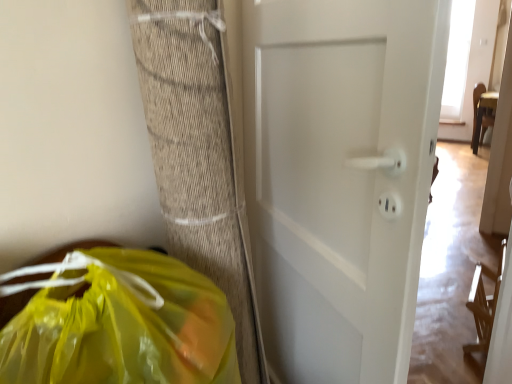
You are a GUI agent. You are given a task and a screenshot of the screen. Output one action in this format:
    pyautogui.click(x=<x>, y=<y>)
    Task: Click on the white matte door at center
    
    Given the screenshot: What is the action you would take?
    click(x=340, y=178)

This screenshot has width=512, height=384. What do you see at coordinates (340, 178) in the screenshot?
I see `white matte door at center` at bounding box center [340, 178].

What is the approximate height of white matte door at center?

It is 4.69 feet.

What do you see at coordinates (120, 323) in the screenshot? I see `translucent yellow plastic bag at lower left` at bounding box center [120, 323].

What is the approximate width of translucent yellow plastic bag at lower left?

translucent yellow plastic bag at lower left is 13.39 inches wide.

Locate an element on the screen. translucent yellow plastic bag at lower left is located at coordinates (120, 323).

At what (x,y) coordinates should I click in order to perform the action: click on white matte door at center. Please return your answer as a coordinate pair (x, y). The height and width of the screenshot is (384, 512). Looking at the image, I should click on (340, 178).

Does translucent yellow plastic bag at lower left appear on the right side of white matte door at center?

In fact, translucent yellow plastic bag at lower left is to the left of white matte door at center.

Is translucent yellow plastic bag at lower left in front of white matte door at center?

Yes, translucent yellow plastic bag at lower left is closer to the camera.

Is point (152, 253) positioned in front of point (385, 91)?

No.

From the image's perspective, is translucent yellow plastic bag at lower left below white matte door at center?

Correct, translucent yellow plastic bag at lower left appears lower than white matte door at center in the image.

In the scene shown: From a real-world perspective, is translucent yellow plastic bag at lower left physically located above or below white matte door at center?

translucent yellow plastic bag at lower left is situated higher than white matte door at center in the real world.

In terms of width, does translucent yellow plastic bag at lower left look wider or thinner when compared to white matte door at center?

Clearly, translucent yellow plastic bag at lower left has more width compared to white matte door at center.

Considering the relative sizes of translucent yellow plastic bag at lower left and white matte door at center in the image provided, is translucent yellow plastic bag at lower left taller than white matte door at center?

In fact, translucent yellow plastic bag at lower left may be shorter than white matte door at center.

Looking at the image, does translucent yellow plastic bag at lower left seem bigger or smaller compared to white matte door at center?

translucent yellow plastic bag at lower left is smaller than white matte door at center.

Is white matte door at center completely or partially inside translucent yellow plastic bag at lower left?

Actually, white matte door at center is outside translucent yellow plastic bag at lower left.

Are translucent yellow plastic bag at lower left and white matte door at center beside each other?

No, translucent yellow plastic bag at lower left is not in contact with white matte door at center.

Is white matte door at center at the back of translucent yellow plastic bag at lower left?

No, translucent yellow plastic bag at lower left's orientation is not away from white matte door at center.

Find the location of a particular element. The width and height of the screenshot is (512, 384). plastic bag in front of the white matte door at center is located at coordinates (120, 323).

Does white matte door at center appear on the right side of translucent yellow plastic bag at lower left?

Correct, you'll find white matte door at center to the right of translucent yellow plastic bag at lower left.

Is white matte door at center in front of or behind translucent yellow plastic bag at lower left in the image?

white matte door at center is positioned farther from the viewer than translucent yellow plastic bag at lower left.

Which is in front, point (353, 236) or point (117, 270)?

Positioned in front is point (117, 270).

From the image's perspective, would you say white matte door at center is positioned over translucent yellow plastic bag at lower left?

Indeed, from the image's perspective, white matte door at center is shown above translucent yellow plastic bag at lower left.

From a real-world perspective, is white matte door at center over translucent yellow plastic bag at lower left?

No, from a real-world perspective, white matte door at center is not over translucent yellow plastic bag at lower left

Can you confirm if white matte door at center is wider than translucent yellow plastic bag at lower left?

No, white matte door at center is not wider than translucent yellow plastic bag at lower left.

Between white matte door at center and translucent yellow plastic bag at lower left, which one has less height?

With less height is translucent yellow plastic bag at lower left.

Between white matte door at center and translucent yellow plastic bag at lower left, which one has larger size?

With larger size is white matte door at center.

Is translucent yellow plastic bag at lower left located within white matte door at center?

No, white matte door at center does not contain translucent yellow plastic bag at lower left.

Are white matte door at center and translucent yellow plastic bag at lower left located far from each other?

No, there isn't a large distance between white matte door at center and translucent yellow plastic bag at lower left.

Is white matte door at center turned away from translucent yellow plastic bag at lower left?

Absolutely, white matte door at center is directed away from translucent yellow plastic bag at lower left.

This screenshot has height=384, width=512. I want to click on door that is behind the translucent yellow plastic bag at lower left, so click(x=340, y=178).

Identify the location of door that is on the right side of translucent yellow plastic bag at lower left. (340, 178).

Find the location of a particular element. Image resolution: width=512 pixels, height=384 pixels. door lying above the translucent yellow plastic bag at lower left (from the image's perspective) is located at coordinates tap(340, 178).